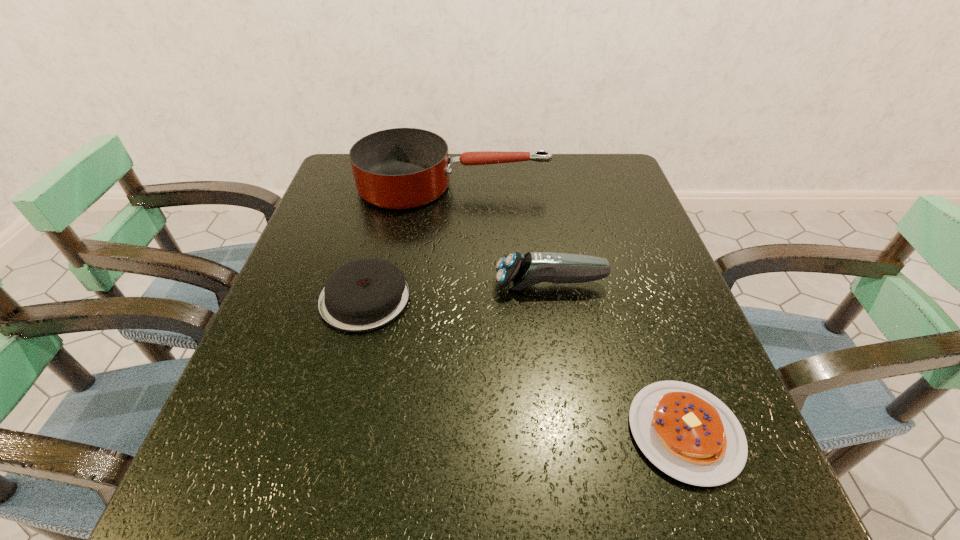
Identify the location of pan. [x=401, y=168].

Where is `the tallest object`? The height and width of the screenshot is (540, 960). the tallest object is located at coordinates (401, 168).

Where is `the third shortest object`? This screenshot has width=960, height=540. the third shortest object is located at coordinates (517, 271).

Locate an element on the screen. This screenshot has width=960, height=540. the taller pancake is located at coordinates (365, 294).

Image resolution: width=960 pixels, height=540 pixels. In order to click on the left pancake in this screenshot , I will do `click(365, 294)`.

This screenshot has width=960, height=540. I want to click on the shortest object, so click(688, 433).

Locate an element on the screen. The width and height of the screenshot is (960, 540). the right pancake is located at coordinates click(688, 433).

Identify the location of blank space located 0.050m on the handle side of the pan. (567, 185).

At what (x,y) coordinates should I click in order to perform the action: click on vacant space located on the head of the electric shaver. Please return your answer as a coordinate pair (x, y). The height and width of the screenshot is (540, 960). Looking at the image, I should click on (381, 285).

I want to click on free space located 0.400m on the head of the electric shaver, so click(305, 285).